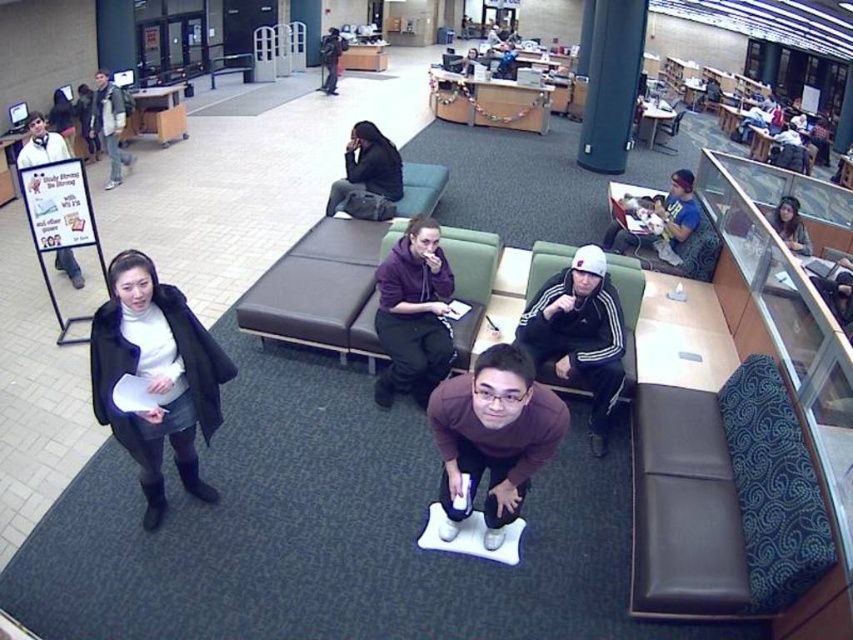
Question: Is black matte coat at left to the right of dark gray hoodie at upper center from the viewer's perspective?

Choices:
 (A) yes
 (B) no

Answer: (A)

Question: Considering the real-world distances, which object is farthest from the white paper sign at left?

Choices:
 (A) light brown leather jacket at upper left
 (B) dark gray fabric chair at center
 (C) brown matte sweater at center

Answer: (C)

Question: Is light brown leather jacket at upper left smaller than dark gray hoodie at upper center?

Choices:
 (A) no
 (B) yes

Answer: (B)

Question: Estimate the real-world distances between objects in this image. Which object is closer to the white paper sign at left?

Choices:
 (A) dark gray hoodie at upper center
 (B) dark gray fabric jacket at center

Answer: (B)

Question: Among these points, which one is farthest from the camera?

Choices:
 (A) (352, 147)
 (B) (740, 428)
 (C) (115, 124)
 (D) (445, 268)

Answer: (C)

Question: Does white paper sign at left lie in front of dark gray hoodie at upper center?

Choices:
 (A) no
 (B) yes

Answer: (B)